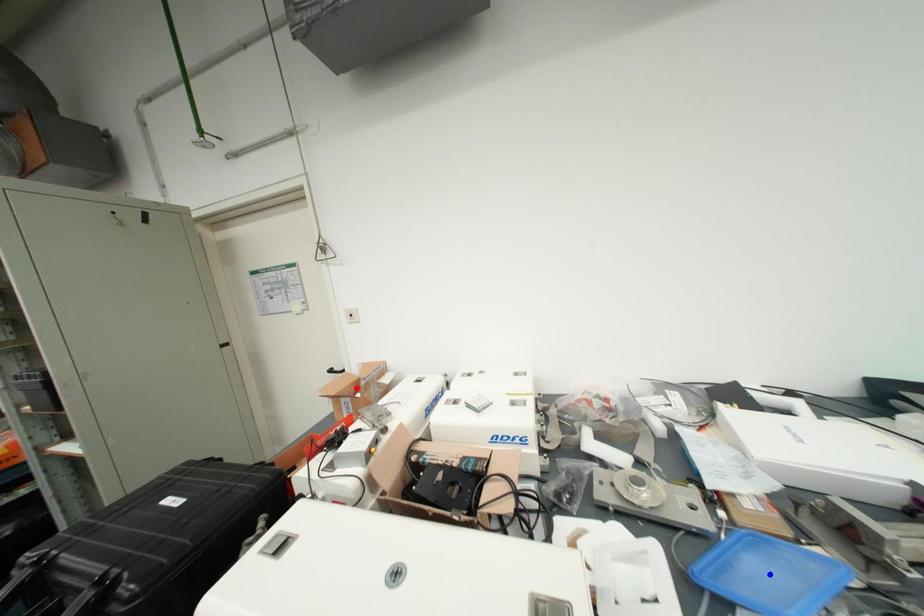
Question: Two points are marked on the image. Which point is closer to the camera?

Choices:
 (A) Blue point is closer.
 (B) Red point is closer.

Answer: (A)